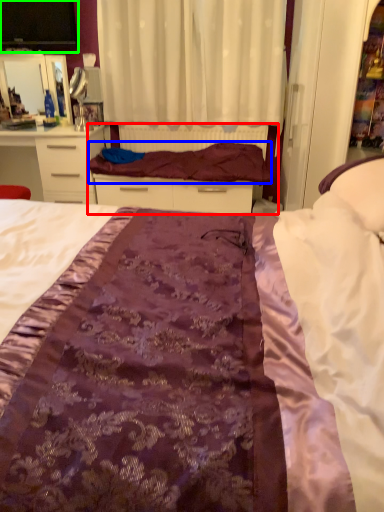
Question: Which is nearer to the bed frame (highlighted by a red box)? blanket (highlighted by a blue box) or desktop (highlighted by a green box).

Choices:
 (A) blanket
 (B) desktop

Answer: (A)